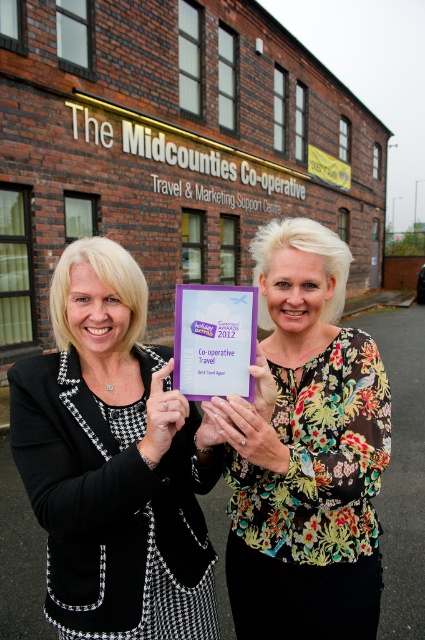
Does black houndstooth blazer at center lie behind purple paper plaque at center?

No, black houndstooth blazer at center is closer to the viewer.

Is black houndstooth blazer at center bigger than purple paper plaque at center?

Yes.

The width and height of the screenshot is (425, 640). Describe the element at coordinates (113, 461) in the screenshot. I see `black houndstooth blazer at center` at that location.

Where is `black houndstooth blazer at center`? This screenshot has height=640, width=425. black houndstooth blazer at center is located at coordinates [113, 461].

Describe the element at coordinates (306, 452) in the screenshot. The image size is (425, 640). I see `floral print blouse at center` at that location.

Does point (266, 516) come behind point (187, 324)?

Yes, point (266, 516) is farther from viewer.

Where is `floral print blouse at center`? The height and width of the screenshot is (640, 425). floral print blouse at center is located at coordinates (306, 452).

Can you confirm if black houndstooth blazer at center is positioned to the left of floral print blouse at center?

Yes, black houndstooth blazer at center is to the left of floral print blouse at center.

Can you confirm if black houndstooth blazer at center is positioned below floral print blouse at center?

Correct, black houndstooth blazer at center is located below floral print blouse at center.

Is point (181, 458) behind point (235, 589)?

That is False.

Locate an element on the screen. Image resolution: width=425 pixels, height=640 pixels. black houndstooth blazer at center is located at coordinates (113, 461).